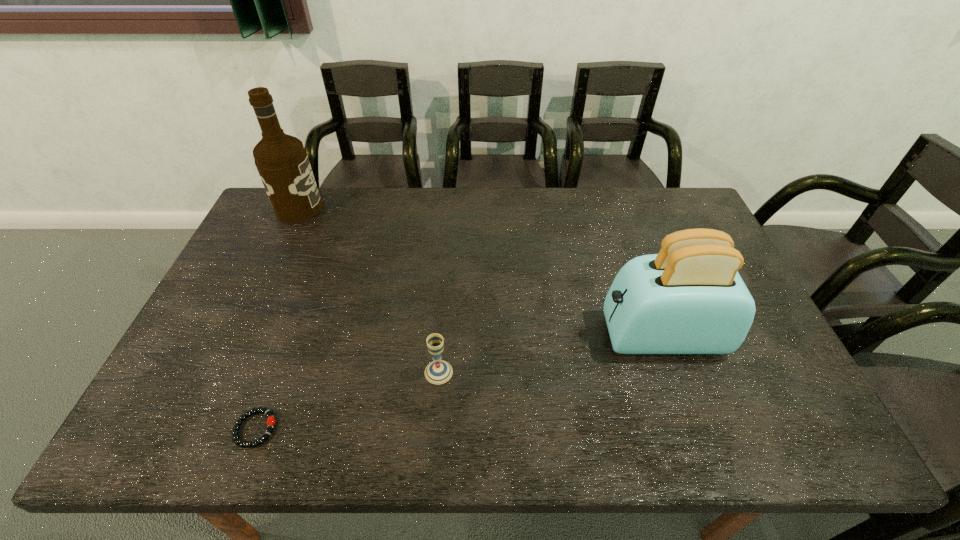
Find the location of a particular element. the tallest object is located at coordinates (282, 162).

Locate an element on the screen. Image resolution: width=960 pixels, height=540 pixels. the leftmost object is located at coordinates (282, 162).

Identify the location of the rightmost object. The image size is (960, 540). (689, 298).

Where is `the third shortest object`? This screenshot has width=960, height=540. the third shortest object is located at coordinates (689, 298).

I want to click on the second object from right to left, so click(x=439, y=371).

This screenshot has height=540, width=960. I want to click on the second shortest object, so click(x=439, y=371).

This screenshot has height=540, width=960. I want to click on the nearest object, so click(x=270, y=422).

Find the location of a particular element. This screenshot has width=960, height=540. the shortest object is located at coordinates tap(270, 422).

Locate an element on the screen. The image size is (960, 540). vacant space located 0.370m on the label of the farthest object is located at coordinates (428, 208).

Where is `vacant space located 0.350m on the side of the third shortest object with the lever`? The height and width of the screenshot is (540, 960). vacant space located 0.350m on the side of the third shortest object with the lever is located at coordinates (468, 336).